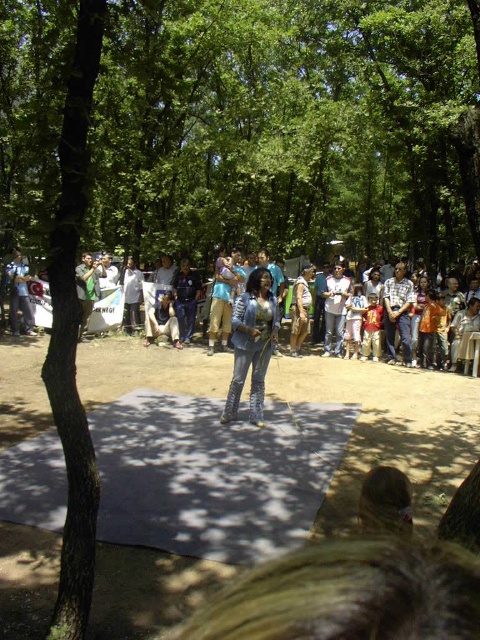
You are a photographer trying to capture the performer on stage. You notice the denim jacket at center and the denim jeans at center. Which piece of clothing should you focus on to ensure it appears larger in your photo?

The denim jacket at center is taller than denim jeans at center, so focusing on the denim jacket at center will make it appear larger in the photo.

Where is the denim jacket at center located in the image?

The denim jacket at center is located at point (252, 342) in the image.

Where is the jeans at center located in the image?

The jeans at center is located at point (106,310).